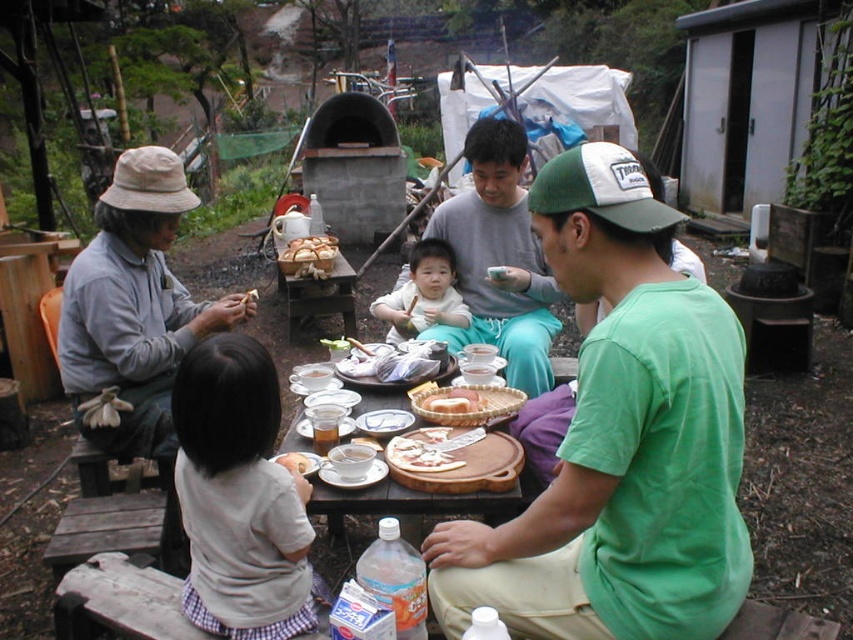
Question: Among these points, which one is farthest from the camera?

Choices:
 (A) (357, 433)
 (B) (265, 572)

Answer: (A)

Question: Can you confirm if wooden table at center is thinner than smooth white bread at center?

Choices:
 (A) no
 (B) yes

Answer: (A)

Question: Does baked golden bread at center come in front of smooth white bread at center?

Choices:
 (A) no
 (B) yes

Answer: (A)

Question: Does matte green shirt at center appear on the left side of light gray cotton shirt at lower left?

Choices:
 (A) no
 (B) yes

Answer: (A)

Question: Which object appears closest to the camera in this image?

Choices:
 (A) green cotton shirt at center
 (B) gray cotton shirt at left
 (C) slightly toasted bread at center
 (D) smooth white bread at center

Answer: (A)

Question: Which of the following is the closest to the observer?

Choices:
 (A) wooden table at center
 (B) white soft baby at center

Answer: (A)